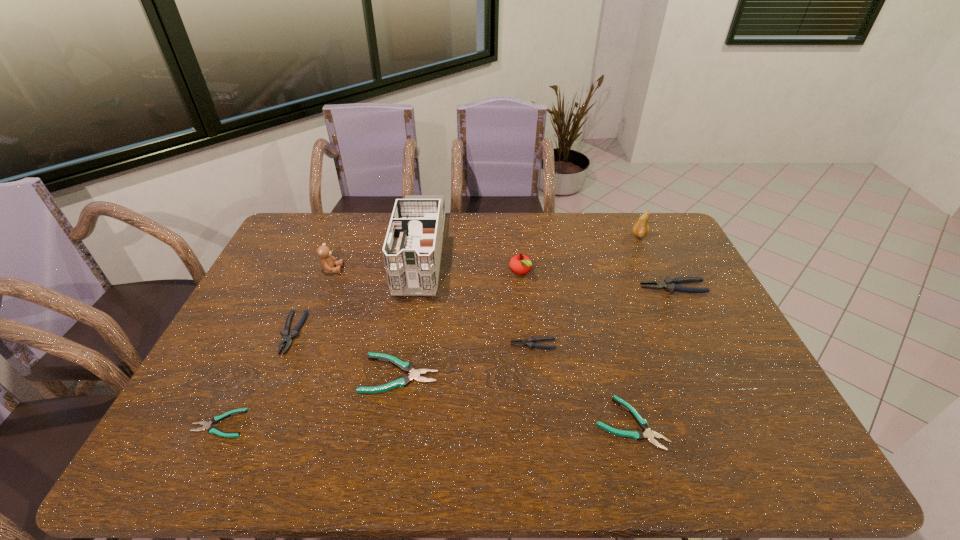
You are a GUI agent. You are given a task and a screenshot of the screen. Output one action in this format:
    pyautogui.click(x=<x>, y=<y>)
    Task: Click on the free location that satisfies the following two spatial constraints: 1. on the back side of the second teal pliers from left to right; 2. on the face of the brown teddy bear
    The height and width of the screenshot is (540, 960).
    Given the screenshot: What is the action you would take?
    pyautogui.click(x=417, y=269)

Where is `free point that satisfies the following two spatial constraints: 1. on the face of the brown teddy bear; 2. on the left side of the fourth tallest pliers`? Image resolution: width=960 pixels, height=540 pixels. free point that satisfies the following two spatial constraints: 1. on the face of the brown teddy bear; 2. on the left side of the fourth tallest pliers is located at coordinates (292, 374).

Where is `free location that satisfies the following two spatial constraints: 1. at the gripping part of the second gray pliers from left to right; 2. on the right side of the eighth object from left to right`? Image resolution: width=960 pixels, height=540 pixels. free location that satisfies the following two spatial constraints: 1. at the gripping part of the second gray pliers from left to right; 2. on the right side of the eighth object from left to right is located at coordinates (542, 423).